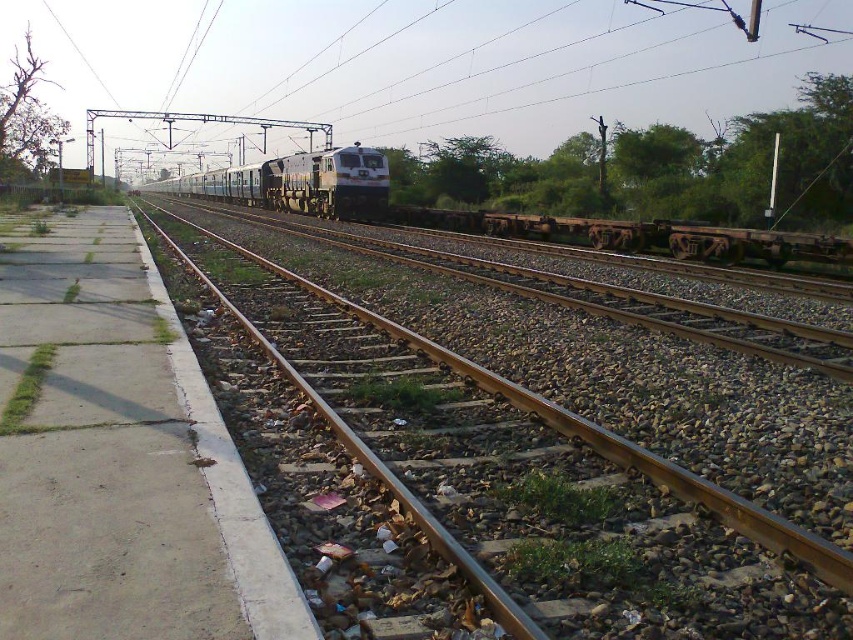
Question: Estimate the real-world distances between objects in this image. Which object is farther from the rusty metal flatbed at center?

Choices:
 (A) brown gravel track at center
 (B) metallic wire at upper center

Answer: (B)

Question: Which of the following is the closest to the observer?

Choices:
 (A) metallic wire at upper center
 (B) rusty metal flatbed at center
 (C) brown gravel track at center
 (D) metallic blue train at center

Answer: (C)

Question: Can you confirm if metallic wire at upper center is positioned to the right of metallic blue train at center?

Choices:
 (A) no
 (B) yes

Answer: (B)

Question: Can you confirm if metallic wire at upper center is bigger than rusty metal flatbed at center?

Choices:
 (A) no
 (B) yes

Answer: (B)

Question: Which point appears closest to the camera in this image?

Choices:
 (A) (381, 193)
 (B) (692, 556)
 (C) (712, 100)
 (D) (436, 224)

Answer: (B)

Question: Does metallic wire at upper center lie behind rusty metal flatbed at center?

Choices:
 (A) no
 (B) yes

Answer: (B)